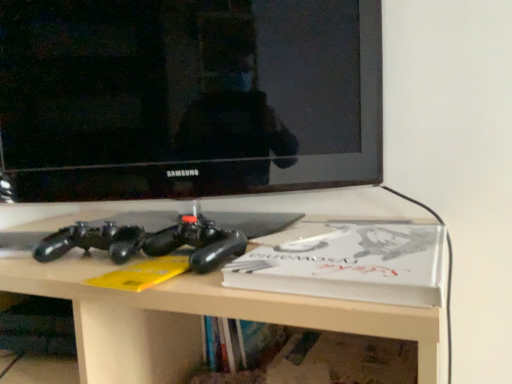
Question: Is matte black controller at center far from white matte paperback book at center?

Choices:
 (A) yes
 (B) no

Answer: (B)

Question: From the image's perspective, is matte black controller at center on top of white matte paperback book at center?

Choices:
 (A) yes
 (B) no

Answer: (B)

Question: Is matte black controller at center facing towards white matte paperback book at center?

Choices:
 (A) yes
 (B) no

Answer: (B)

Question: Is matte black controller at center at the right side of white matte paperback book at center?

Choices:
 (A) no
 (B) yes

Answer: (A)

Question: Is matte black controller at center smaller than white matte paperback book at center?

Choices:
 (A) no
 (B) yes

Answer: (A)

Question: Would you say black glossy television at upper center is to the left or to the right of white matte paperback book at center in the picture?

Choices:
 (A) right
 (B) left

Answer: (B)

Question: Considering their positions, is black glossy television at upper center located in front of or behind white matte paperback book at center?

Choices:
 (A) front
 (B) behind

Answer: (B)

Question: From their relative heights in the image, would you say black glossy television at upper center is taller or shorter than white matte paperback book at center?

Choices:
 (A) short
 (B) tall

Answer: (B)

Question: Based on their sizes in the image, would you say black glossy television at upper center is bigger or smaller than white matte paperback book at center?

Choices:
 (A) small
 (B) big

Answer: (B)

Question: Is white matte paperback book at center inside the boundaries of matte black controller at center, or outside?

Choices:
 (A) outside
 (B) inside

Answer: (B)

Question: Visually, is white matte paperback book at center positioned to the left or to the right of matte black controller at center?

Choices:
 (A) left
 (B) right

Answer: (B)

Question: In the image, is white matte paperback book at center positioned in front of or behind matte black controller at center?

Choices:
 (A) behind
 (B) front

Answer: (A)

Question: From the image's perspective, is white matte paperback book at center positioned above or below matte black controller at center?

Choices:
 (A) below
 (B) above

Answer: (B)

Question: In terms of width, does matte black controller at center look wider or thinner when compared to black glossy television at upper center?

Choices:
 (A) thin
 (B) wide

Answer: (B)

Question: From the image's perspective, is matte black controller at center positioned above or below black glossy television at upper center?

Choices:
 (A) below
 (B) above

Answer: (A)